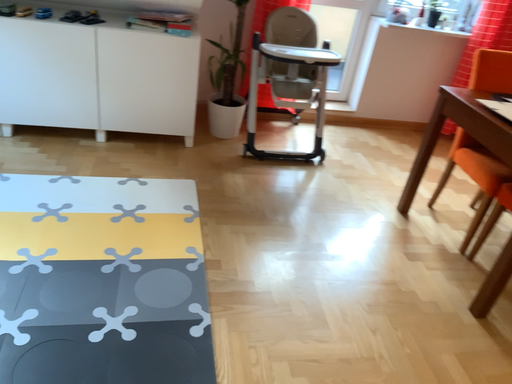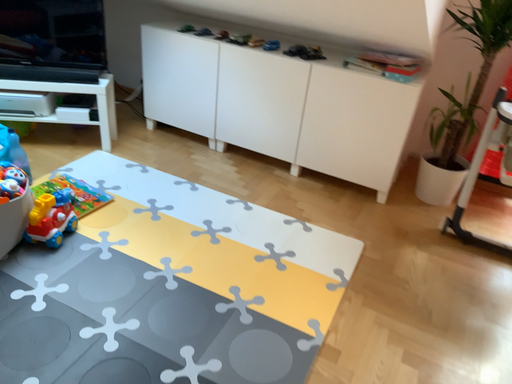
Question: Which way did the camera rotate in the video?

Choices:
 (A) rotated upward
 (B) rotated downward

Answer: (A)